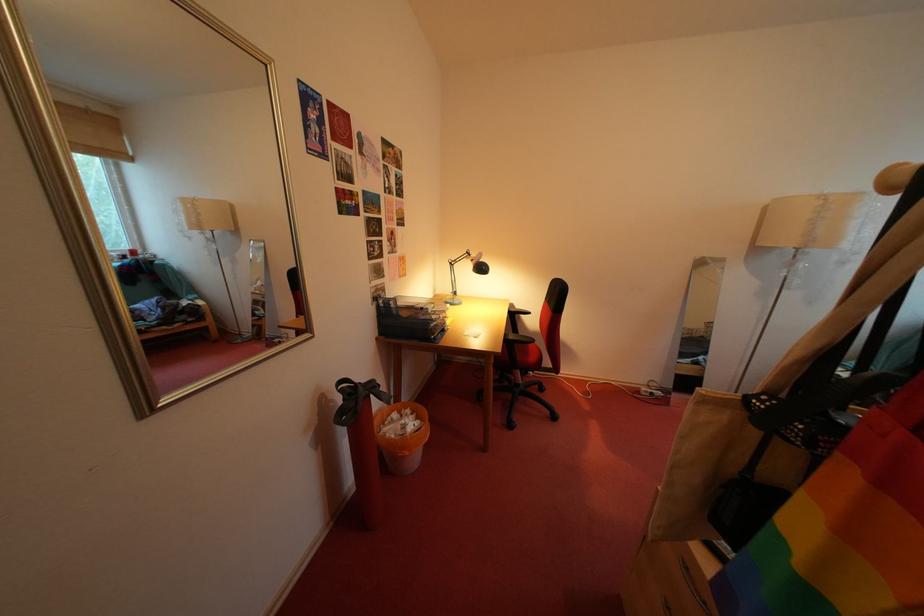
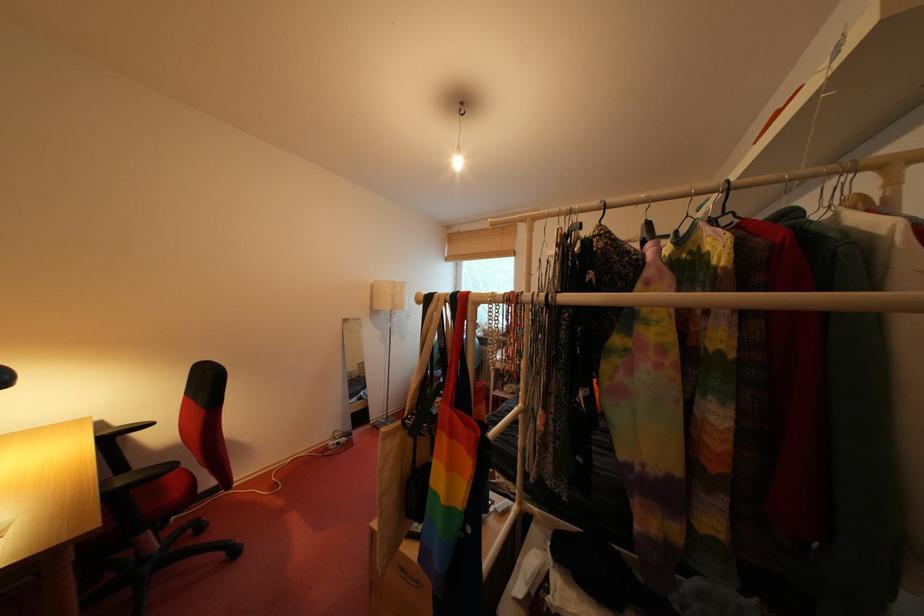
Locate, in the second image, the point that corresponds to point 862,541 in the first image.

(462, 472)